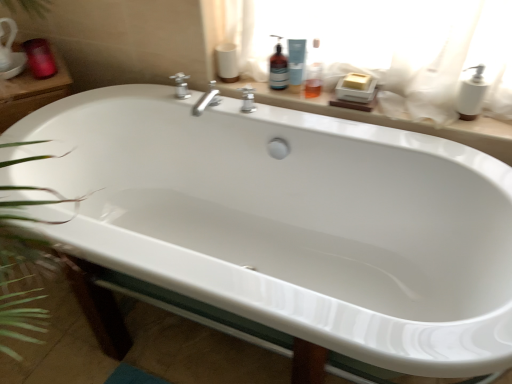
Image resolution: width=512 pixels, height=384 pixels. Find the location of `matte red candle at upper left`. matte red candle at upper left is located at coordinates (40, 58).

This screenshot has width=512, height=384. What do you see at coordinates (40, 58) in the screenshot? I see `matte red candle at upper left` at bounding box center [40, 58].

What are the coordinates of `blue plastic bottle at upper center, acting as the second cleaning product starting from the left` in the screenshot? It's located at [x=296, y=61].

Describe the element at coordinates (278, 68) in the screenshot. This screenshot has height=384, width=512. I see `translucent plastic bottle at upper center, placed as the 2th cleaning product when sorted from right to left` at that location.

You are a GUI agent. You are given a task and a screenshot of the screen. Output one action in this format:
    pyautogui.click(x=<x>, y=<y>)
    Task: Click on the white matte toilet paper at upper center
    This screenshot has height=384, width=512.
    Given the screenshot: What is the action you would take?
    pyautogui.click(x=227, y=62)

Considering the relative positions of white plastic soap dispenser at upper right and matte beige soap dish at upper center in the image provided, is white plastic soap dispenser at upper right to the right of matte beige soap dish at upper center from the viewer's perspective?

Indeed, white plastic soap dispenser at upper right is positioned on the right side of matte beige soap dish at upper center.

You are a GUI agent. You are given a task and a screenshot of the screen. Output one action in this format:
    pyautogui.click(x=<x>, y=<y>)
    Task: Click on the soap dispenser located below the matte beige soap dish at upper center (from the image's perspective)
    
    Given the screenshot: What is the action you would take?
    pyautogui.click(x=472, y=95)

Between white plastic soap dispenser at upper right and matte beige soap dish at upper center, which one has less height?

matte beige soap dish at upper center.

In the scene shown: Can you confirm if matte beige soap dish at upper center is positioned to the left of white plastic soap dispenser at upper right?

Indeed, matte beige soap dish at upper center is positioned on the left side of white plastic soap dispenser at upper right.

In terms of width, does matte beige soap dish at upper center look wider or thinner when compared to white plastic soap dispenser at upper right?

Clearly, matte beige soap dish at upper center has more width compared to white plastic soap dispenser at upper right.

You are a GUI agent. You are given a task and a screenshot of the screen. Output one action in this format:
    pyautogui.click(x=<x>, y=<y>)
    Task: Click on the soap dispenser that is in front of the matte beige soap dish at upper center
    This screenshot has height=384, width=512.
    Given the screenshot: What is the action you would take?
    pyautogui.click(x=472, y=95)

Consider the image. Is white plastic soap dispenser at upper right a part of matte beige soap dish at upper center?

No.

Is matte red candle at upper left at the right side of white plastic soap dispenser at upper right?

No.

Where is `toiletry located above the white plastic soap dispenser at upper right (from a real-world perspective)`? This screenshot has height=384, width=512. toiletry located above the white plastic soap dispenser at upper right (from a real-world perspective) is located at coordinates (40, 58).

From a real-world perspective, is matte red candle at upper left positioned above or below white plastic soap dispenser at upper right?

Clearly, from a real-world perspective, matte red candle at upper left is above white plastic soap dispenser at upper right.

Could you tell me if matte red candle at upper left is facing white plastic soap dispenser at upper right?

No, matte red candle at upper left is not aimed at white plastic soap dispenser at upper right.

Is point (217, 59) closer to camera compared to point (27, 42)?

Yes.

Are white matte toilet paper at upper center and matte red candle at upper left far apart?

Actually, white matte toilet paper at upper center and matte red candle at upper left are a little close together.

Which is correct: white matte toilet paper at upper center is inside matte red candle at upper left, or outside of it?

white matte toilet paper at upper center is not enclosed by matte red candle at upper left.

How different are the orientations of white matte toilet paper at upper center and matte red candle at upper left in degrees?

The angular difference between white matte toilet paper at upper center and matte red candle at upper left is 53.7 degrees.

Would you say matte red candle at upper left is a long distance from translucent plastic bottle at upper center, placed as the 2th cleaning product when sorted from right to left?

No, matte red candle at upper left is not far from translucent plastic bottle at upper center, placed as the 2th cleaning product when sorted from right to left.

Considering the sizes of objects matte red candle at upper left and translucent plastic bottle at upper center, placed as the 2th cleaning product when sorted from right to left, in the image provided, who is thinner, matte red candle at upper left or translucent plastic bottle at upper center, placed as the 2th cleaning product when sorted from right to left,?

translucent plastic bottle at upper center, placed as the 2th cleaning product when sorted from right to left.

How different are the orientations of matte red candle at upper left and translucent plastic bottle at upper center, placed as the 2th cleaning product when sorted from right to left, in degrees?

The facing directions of matte red candle at upper left and translucent plastic bottle at upper center, placed as the 2th cleaning product when sorted from right to left, are 58.2 degrees apart.

In the image, is matte red candle at upper left positioned in front of or behind translucent plastic bottle at upper center, acting as the 1th cleaning product starting from the left?

Clearly, matte red candle at upper left is behind translucent plastic bottle at upper center, acting as the 1th cleaning product starting from the left.

From a real-world perspective, is translucent plastic bottle at upper center, acting as the 1th cleaning product starting from the left, positioned above or below matte red candle at upper left?

In terms of real-world spatial position, translucent plastic bottle at upper center, acting as the 1th cleaning product starting from the left, is above matte red candle at upper left.

Is the position of translucent plastic bottle at upper center, placed as the 2th cleaning product when sorted from right to left, more distant than that of matte red candle at upper left?

No, translucent plastic bottle at upper center, placed as the 2th cleaning product when sorted from right to left, is in front of matte red candle at upper left.

In the scene shown: Which is farther, (275,64) or (29,46)?

The point (29,46) is behind.

From the picture: From a real-world perspective, is matte beige soap dish at upper center located higher than blue plastic bottle at upper center, the first cleaning product in the right-to-left sequence?

No.

Measure the distance from matte beige soap dish at upper center to blue plastic bottle at upper center, acting as the second cleaning product starting from the left.

matte beige soap dish at upper center is 10.36 inches away from blue plastic bottle at upper center, acting as the second cleaning product starting from the left.

Is matte beige soap dish at upper center in front of or behind blue plastic bottle at upper center, acting as the second cleaning product starting from the left, in the image?

matte beige soap dish at upper center is positioned closer to the viewer than blue plastic bottle at upper center, acting as the second cleaning product starting from the left.

From the image's perspective, is matte beige soap dish at upper center over blue plastic bottle at upper center, the first cleaning product in the right-to-left sequence?

No, from the image's perspective, matte beige soap dish at upper center is not above blue plastic bottle at upper center, the first cleaning product in the right-to-left sequence.

You are a GUI agent. You are given a task and a screenshot of the screen. Output one action in this format:
    pyautogui.click(x=<x>, y=<y>)
    Task: Click on the window sill lying above the white plastic soap dispenser at upper right (from the image's perspective)
    This screenshot has height=384, width=512.
    Given the screenshot: What is the action you would take?
    pyautogui.click(x=387, y=118)

Where is `soap dispenser in front of the matte beige soap dish at upper center`? soap dispenser in front of the matte beige soap dish at upper center is located at coordinates (472, 95).

Based on their spatial positions, is blue plastic bottle at upper center, the first cleaning product in the right-to-left sequence, or matte beige soap dish at upper center further from white plastic soap dispenser at upper right?

blue plastic bottle at upper center, the first cleaning product in the right-to-left sequence, is positioned further to the anchor white plastic soap dispenser at upper right.

From the image, which object appears to be farther from matte beige soap dish at upper center, white matte toilet paper at upper center or matte red candle at upper left?

The object further to matte beige soap dish at upper center is matte red candle at upper left.

Looking at the image, which one is located further to matte beige soap dish at upper center, blue plastic bottle at upper center, the first cleaning product in the right-to-left sequence, or white plastic soap dispenser at upper right?

The object further to matte beige soap dish at upper center is blue plastic bottle at upper center, the first cleaning product in the right-to-left sequence.

Which object lies further to the anchor point white matte toilet paper at upper center, blue plastic bottle at upper center, acting as the second cleaning product starting from the left, or matte red candle at upper left?

The object further to white matte toilet paper at upper center is matte red candle at upper left.

Based on their spatial positions, is matte red candle at upper left or matte beige soap dish at upper center further from white matte toilet paper at upper center?

Based on the image, matte red candle at upper left appears to be further to white matte toilet paper at upper center.

Estimate the real-world distances between objects in this image. Which object is further from matte red candle at upper left, white matte toilet paper at upper center or translucent plastic bottle at upper center, acting as the 1th cleaning product starting from the left?

The object further to matte red candle at upper left is translucent plastic bottle at upper center, acting as the 1th cleaning product starting from the left.

Estimate the real-world distances between objects in this image. Which object is further from matte beige soap dish at upper center, white plastic soap dispenser at upper right or matte red candle at upper left?

matte red candle at upper left is positioned further to the anchor matte beige soap dish at upper center.

When comparing their distances from matte red candle at upper left, does matte beige soap dish at upper center or blue plastic bottle at upper center, acting as the second cleaning product starting from the left, seem closer?

The object closer to matte red candle at upper left is blue plastic bottle at upper center, acting as the second cleaning product starting from the left.

Locate an element on the screen. The image size is (512, 384). cleaning product located between white matte toilet paper at upper center and blue plastic bottle at upper center, the first cleaning product in the right-to-left sequence, in the left-right direction is located at coordinates (278, 68).

This screenshot has width=512, height=384. What are the coordinates of `window sill situated between matte red candle at upper left and white plastic soap dispenser at upper right from left to right` in the screenshot? It's located at (387, 118).

Identify the location of toilet paper located between matte red candle at upper left and blue plastic bottle at upper center, the first cleaning product in the right-to-left sequence, in the left-right direction. The width and height of the screenshot is (512, 384). (227, 62).

I want to click on window sill located between translucent plastic bottle at upper center, acting as the 1th cleaning product starting from the left, and white plastic soap dispenser at upper right in the left-right direction, so click(387, 118).